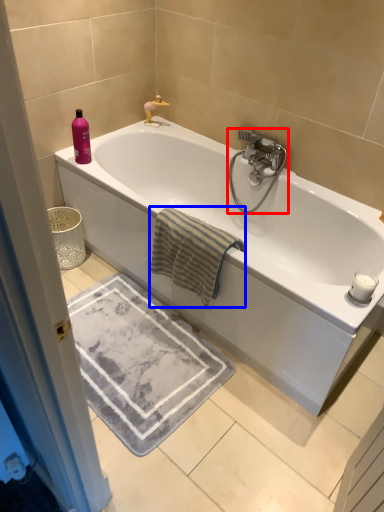
Question: Among these objects, which one is nearest to the camera, tap (highlighted by a red box) or beach towel (highlighted by a blue box)?

Choices:
 (A) tap
 (B) beach towel

Answer: (B)